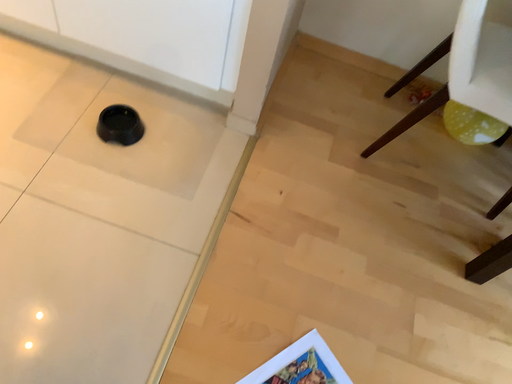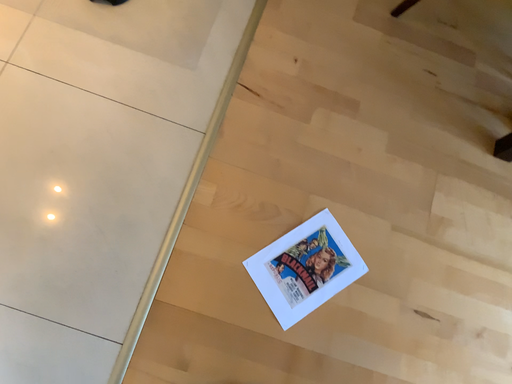
Question: How did the camera likely rotate when shooting the video?

Choices:
 (A) rotated downward
 (B) rotated upward

Answer: (A)